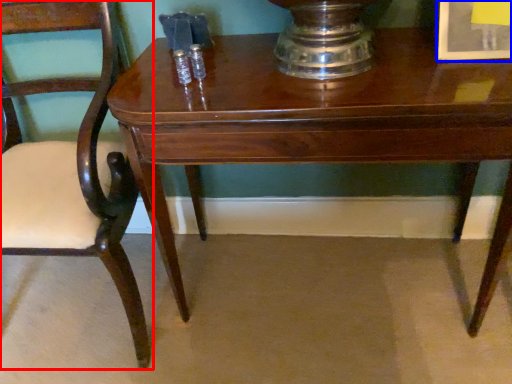
Question: Which object appears farthest to the camera in this image, chair (highlighted by a red box) or picture frame (highlighted by a blue box)?

Choices:
 (A) chair
 (B) picture frame

Answer: (B)